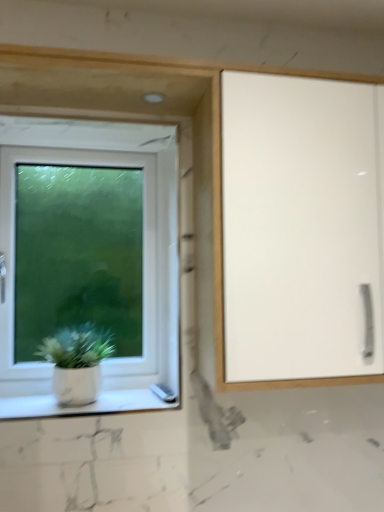
Question: Should I look upward or downward to see white plastic window at left?

Choices:
 (A) down
 (B) up

Answer: (A)

Question: Is white glossy cabinet at right directly adjacent to white marble window sill at lower left?

Choices:
 (A) no
 (B) yes

Answer: (A)

Question: Can you confirm if white glossy cabinet at right is shorter than white marble window sill at lower left?

Choices:
 (A) yes
 (B) no

Answer: (B)

Question: Is white marble window sill at lower left at the back of white glossy cabinet at right?

Choices:
 (A) no
 (B) yes

Answer: (A)

Question: Is white glossy cabinet at right behind white marble window sill at lower left?

Choices:
 (A) no
 (B) yes

Answer: (A)

Question: Considering the relative sizes of white glossy cabinet at right and white marble window sill at lower left in the image provided, is white glossy cabinet at right bigger than white marble window sill at lower left?

Choices:
 (A) no
 (B) yes

Answer: (B)

Question: Considering the relative sizes of white glossy cabinet at right and white marble window sill at lower left in the image provided, is white glossy cabinet at right thinner than white marble window sill at lower left?

Choices:
 (A) no
 (B) yes

Answer: (A)

Question: Considering the relative sizes of white glossy cabinet at right and white matte pot at lower left in the image provided, is white glossy cabinet at right wider than white matte pot at lower left?

Choices:
 (A) no
 (B) yes

Answer: (B)

Question: Can you see white glossy cabinet at right touching white matte pot at lower left?

Choices:
 (A) yes
 (B) no

Answer: (B)

Question: Is white glossy cabinet at right taller than white matte pot at lower left?

Choices:
 (A) no
 (B) yes

Answer: (B)

Question: Is white glossy cabinet at right oriented towards white matte pot at lower left?

Choices:
 (A) no
 (B) yes

Answer: (A)

Question: Would you consider white glossy cabinet at right to be distant from white matte pot at lower left?

Choices:
 (A) no
 (B) yes

Answer: (A)

Question: Is white glossy cabinet at right in front of white matte pot at lower left?

Choices:
 (A) yes
 (B) no

Answer: (A)

Question: Is the surface of white matte pot at lower left in direct contact with white glossy cabinet at right?

Choices:
 (A) yes
 (B) no

Answer: (B)